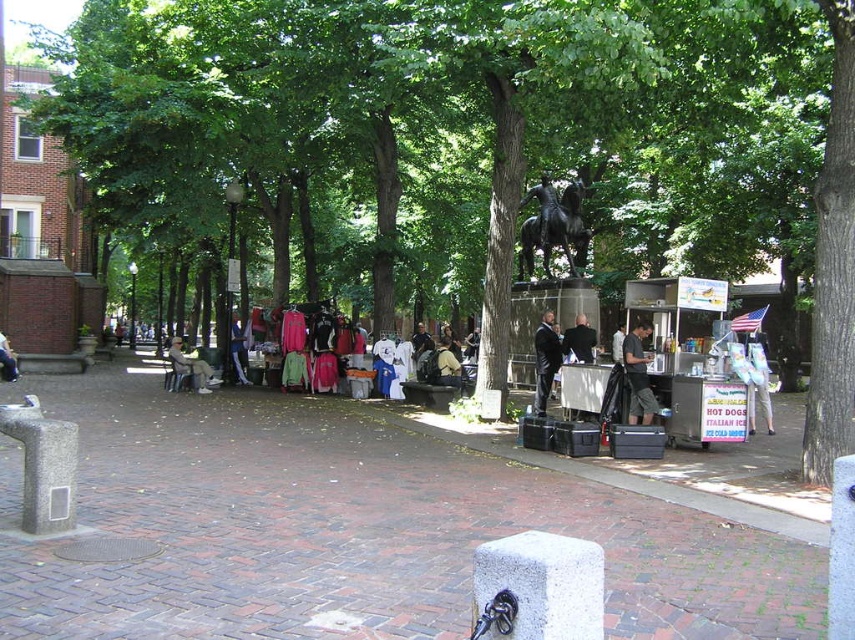
Question: Does dark gray shirt at right have a greater width compared to denim pants at lower left?

Choices:
 (A) no
 (B) yes

Answer: (B)

Question: Is dark gray suit at center positioned in front of denim jacket at center?

Choices:
 (A) no
 (B) yes

Answer: (B)

Question: Which of the following is the closest to the observer?

Choices:
 (A) (646, 381)
 (B) (759, 336)

Answer: (A)

Question: Is green leafy tree at center positioned at the back of khaki pants at center?

Choices:
 (A) no
 (B) yes

Answer: (A)

Question: Among these points, which one is nearest to the camera?

Choices:
 (A) (547, 355)
 (B) (587, 342)
 (C) (765, 342)
 (D) (652, 417)

Answer: (D)

Question: Which point appears farthest from the camera in this image?

Choices:
 (A) (764, 400)
 (B) (552, 342)

Answer: (B)